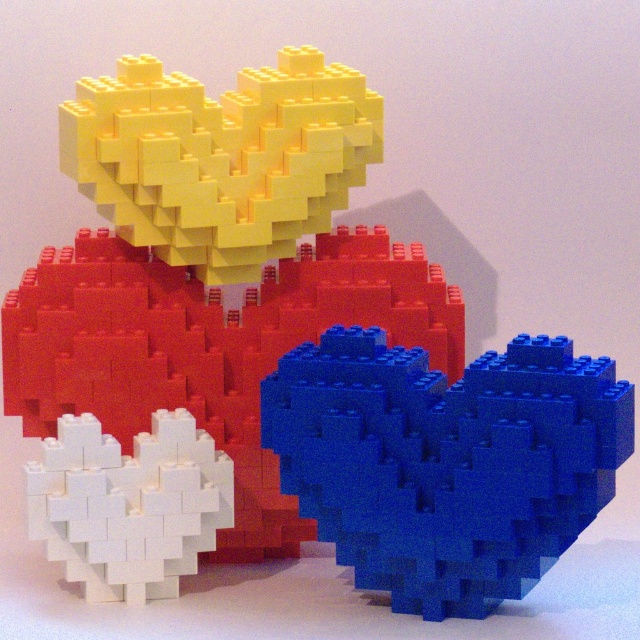
Question: Is blue matte heart at center below white matte heart at lower left?

Choices:
 (A) yes
 (B) no

Answer: (B)

Question: Which of the following is the farthest from the observer?

Choices:
 (A) white matte heart at lower left
 (B) blue matte heart at center

Answer: (A)

Question: Does blue matte heart at center have a smaller size compared to white matte heart at lower left?

Choices:
 (A) no
 (B) yes

Answer: (A)

Question: Which of the following is the closest to the observer?

Choices:
 (A) blue matte heart at center
 (B) white matte heart at lower left

Answer: (A)

Question: Which object is closer to the camera taking this photo?

Choices:
 (A) white matte heart at lower left
 (B) blue matte heart at center

Answer: (B)

Question: Is blue matte heart at center further to camera compared to white matte heart at lower left?

Choices:
 (A) yes
 (B) no

Answer: (B)